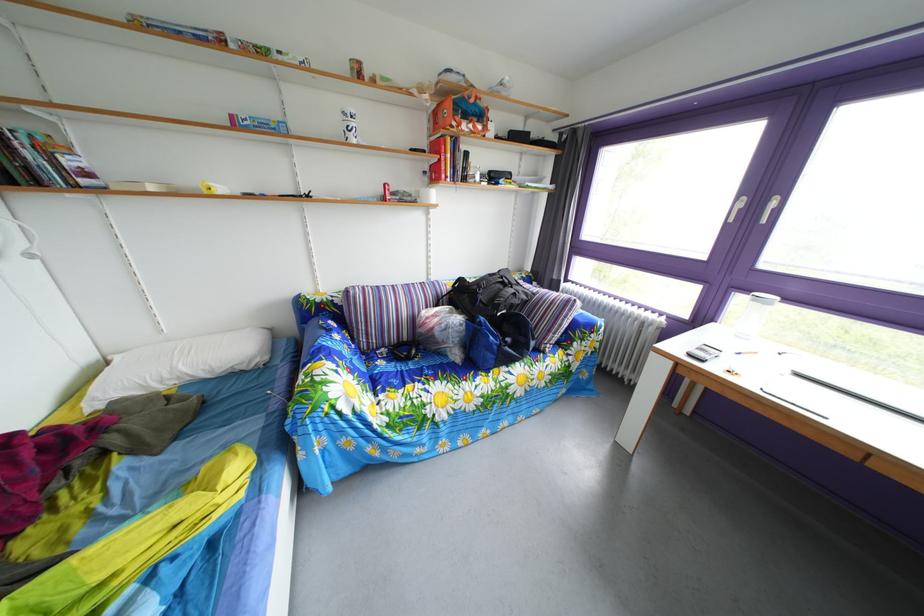
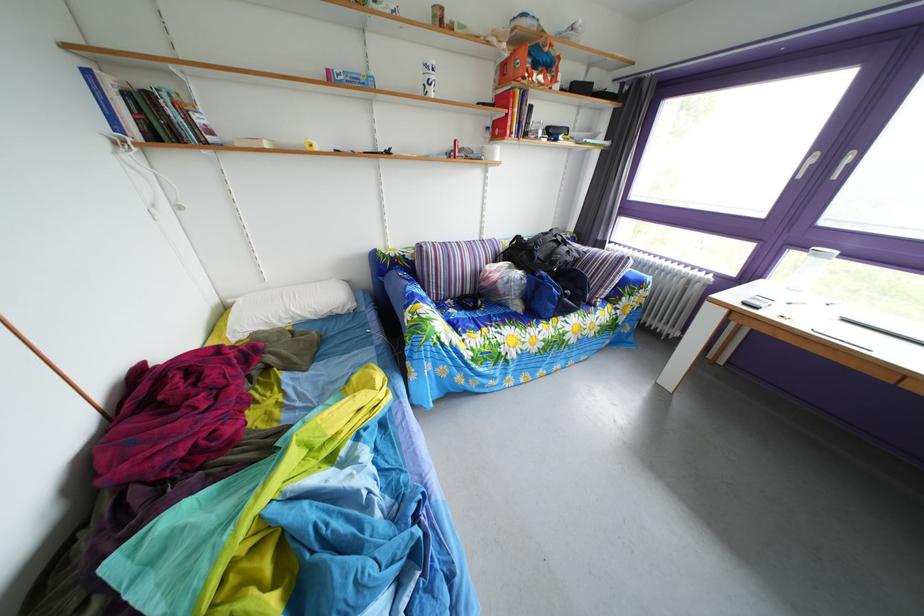
Locate, in the second image, the point that corresponds to (x=435, y=180) in the first image.

(499, 137)